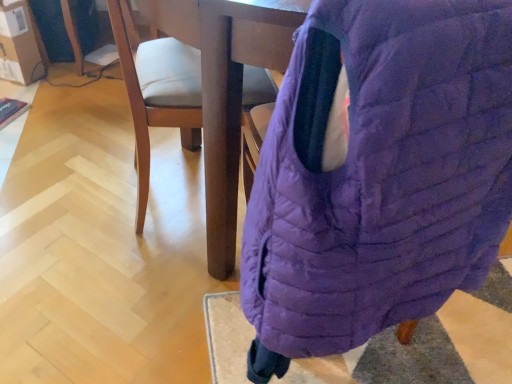
The width and height of the screenshot is (512, 384). In order to click on free space between light brown wood chair at center and matte brown cardboard at upper left in this screenshot , I will do `click(76, 127)`.